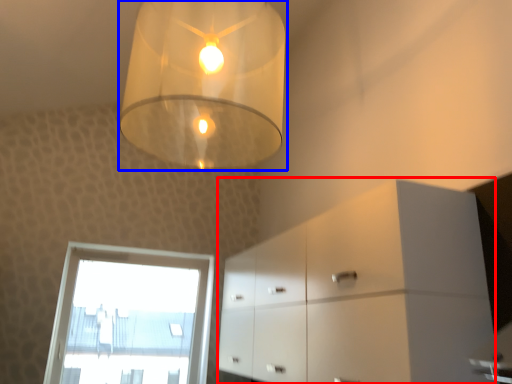
Question: Which of the following is the closest to the observer, dresser (highlighted by a red box) or lamp (highlighted by a blue box)?

Choices:
 (A) dresser
 (B) lamp

Answer: (B)